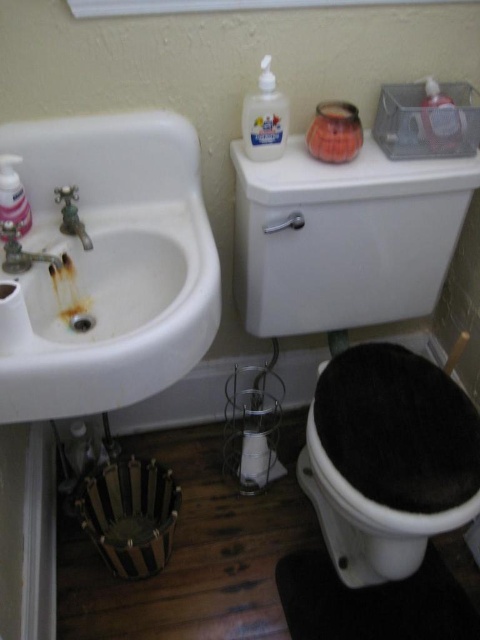
You are a maintenance worker holding a 28 inch long tool. You need to place it on the white glossy sink at left. Can the tool fit on the sink without hanging over the edge?

The distance between the white glossy sink at left and the camera is 30.83 inches. Since the tool is 28 inches long, it can fit on the sink as it is shorter than the distance available.

You are trying to determine which object is taller between the black fuzzy toilet bowl at lower right and the clear plastic bottle at upper center. Based on the scene, which one is taller?

The black fuzzy toilet bowl at lower right is taller than the clear plastic bottle at upper center.

You are a maintenance worker who needs to reach both the clear plastic bottle at upper center and the brushed metal faucet at sink left. If your reach extends 18 inches, can you grab both items without moving your position?

The clear plastic bottle at upper center is 18.29 inches from the brushed metal faucet at sink left. Since your reach extends 18 inches, you cannot grab both items without moving your position because the distance between them exceeds your reach.